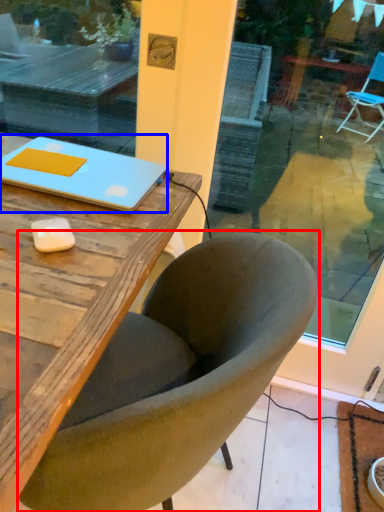
Question: Among these objects, which one is nearest to the camera, chair (highlighted by a red box) or laptop (highlighted by a blue box)?

Choices:
 (A) chair
 (B) laptop

Answer: (A)